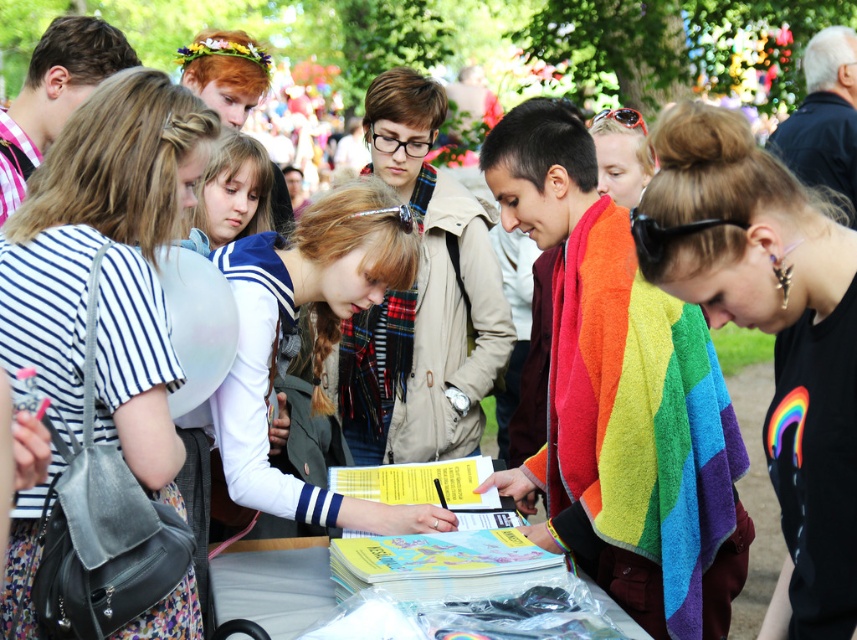
Question: Which object appears closest to the camera in this image?

Choices:
 (A) yellow paper book at center
 (B) rainbow fabric towel at center
 (C) white plastic table at center
 (D) rainbow towel at center

Answer: (B)

Question: Considering the real-world distances, which object is closest to the yellow paper book at center?

Choices:
 (A) white plastic table at center
 (B) rainbow towel at center
 (C) rainbow fabric towel at center

Answer: (A)

Question: Is white sailor uniform at center bigger than white plastic table at center?

Choices:
 (A) yes
 (B) no

Answer: (A)

Question: Which is nearer to the rainbow towel at center?

Choices:
 (A) white sailor uniform at center
 (B) yellow paper book at center
 (C) rainbow fabric towel at center
 (D) white plastic table at center

Answer: (B)

Question: Is white sailor uniform at center in front of yellow paper book at center?

Choices:
 (A) no
 (B) yes

Answer: (A)

Question: Is rainbow fabric towel at center below white plastic table at center?

Choices:
 (A) no
 (B) yes

Answer: (A)